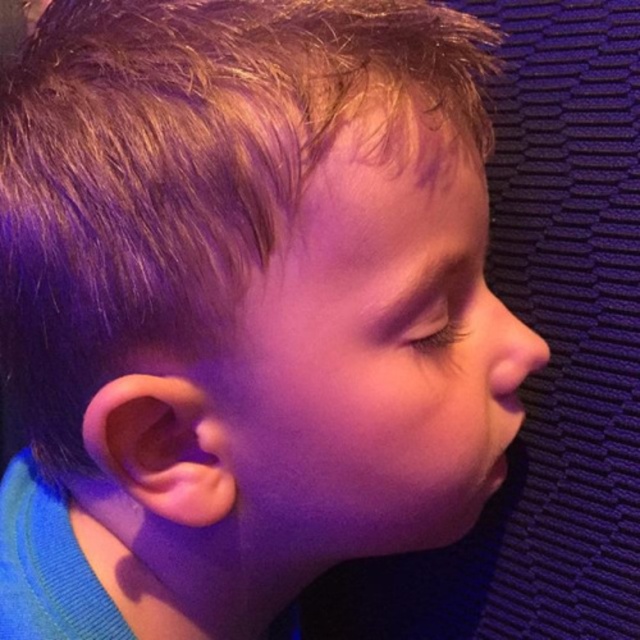
Question: Is smooth skin face at center above shiny brown eye at center?

Choices:
 (A) yes
 (B) no

Answer: (B)

Question: Can you confirm if smooth skin face at center is thinner than shiny brown eye at center?

Choices:
 (A) no
 (B) yes

Answer: (A)

Question: Estimate the real-world distances between objects in this image. Which object is farther from the blonde smooth hair at upper left?

Choices:
 (A) smooth skin face at center
 (B) shiny brown eye at center
 (C) smooth flesh nose at center

Answer: (C)

Question: Does blonde smooth hair at upper left appear on the left side of shiny brown eye at center?

Choices:
 (A) no
 (B) yes

Answer: (B)

Question: Estimate the real-world distances between objects in this image. Which object is farther from the shiny brown eye at center?

Choices:
 (A) blonde smooth hair at upper left
 (B) smooth flesh nose at center
 (C) smooth skin face at center

Answer: (A)

Question: Which object appears closest to the camera in this image?

Choices:
 (A) smooth flesh nose at center
 (B) blonde smooth hair at upper left
 (C) smooth skin face at center

Answer: (B)